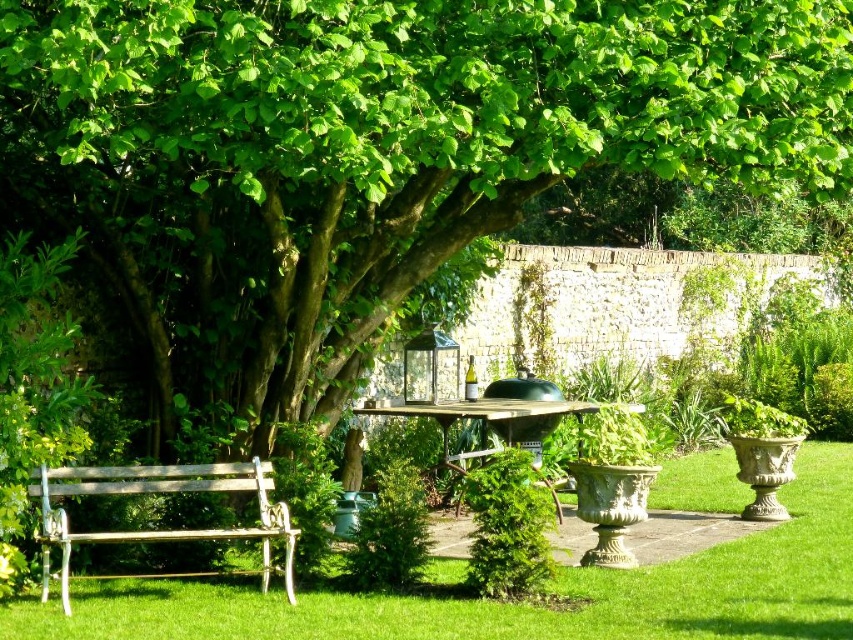
Question: Does wooden bench at lower left appear under smooth wooden table at center?

Choices:
 (A) yes
 (B) no

Answer: (A)

Question: Considering the real-world distances, which object is closest to the green grass at lower center?

Choices:
 (A) wooden bench at lower left
 (B) smooth wooden table at center

Answer: (A)

Question: Can you confirm if green grass at lower center is wider than wooden bench at lower left?

Choices:
 (A) yes
 (B) no

Answer: (A)

Question: Which of the following is the closest to the observer?

Choices:
 (A) (476, 417)
 (B) (245, 529)

Answer: (B)

Question: Can you confirm if green grass at lower center is positioned to the right of wooden bench at lower left?

Choices:
 (A) yes
 (B) no

Answer: (A)

Question: Which of the following is the farthest from the observer?

Choices:
 (A) green grass at lower center
 (B) smooth wooden table at center

Answer: (B)